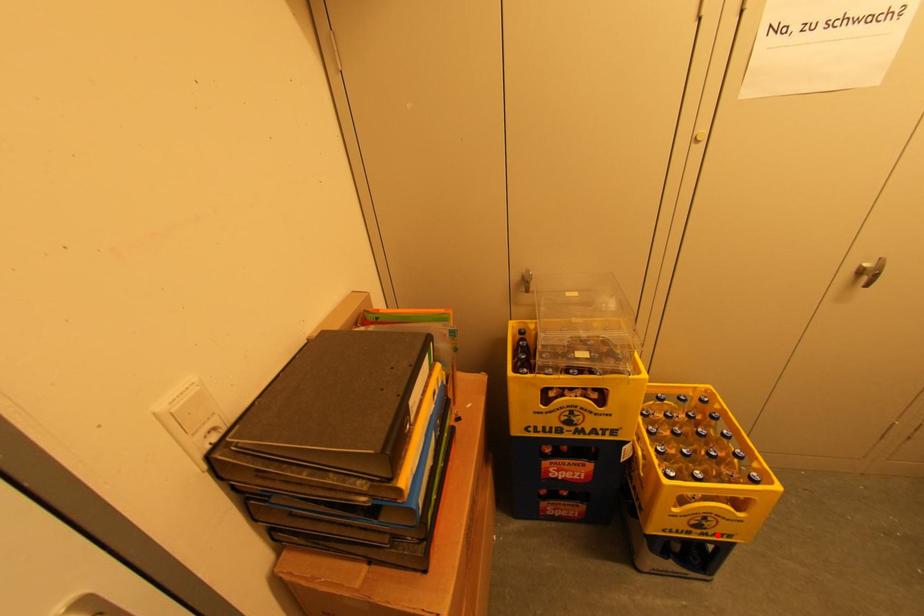
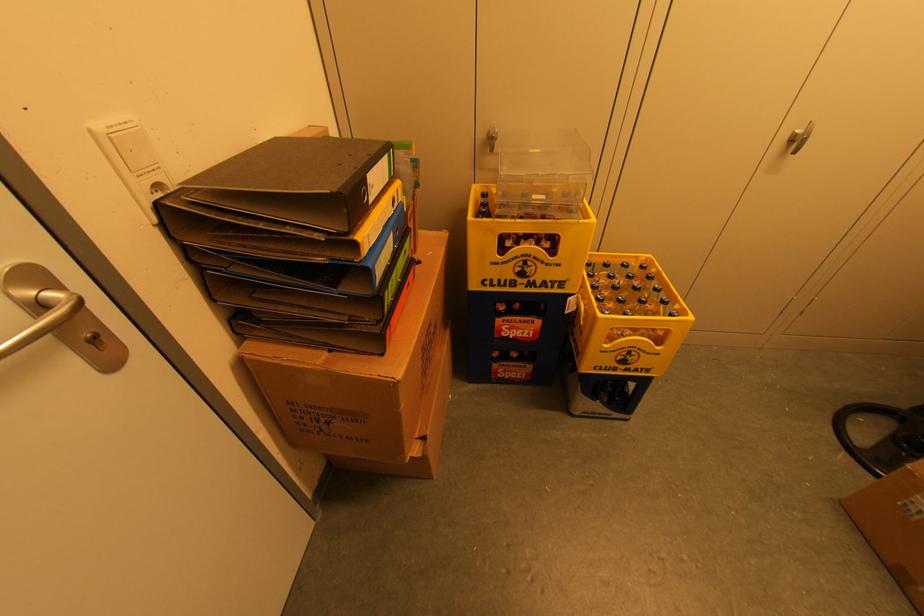
In the second image, find the point that corresponds to the highlighted location in the first image.

(638, 370)